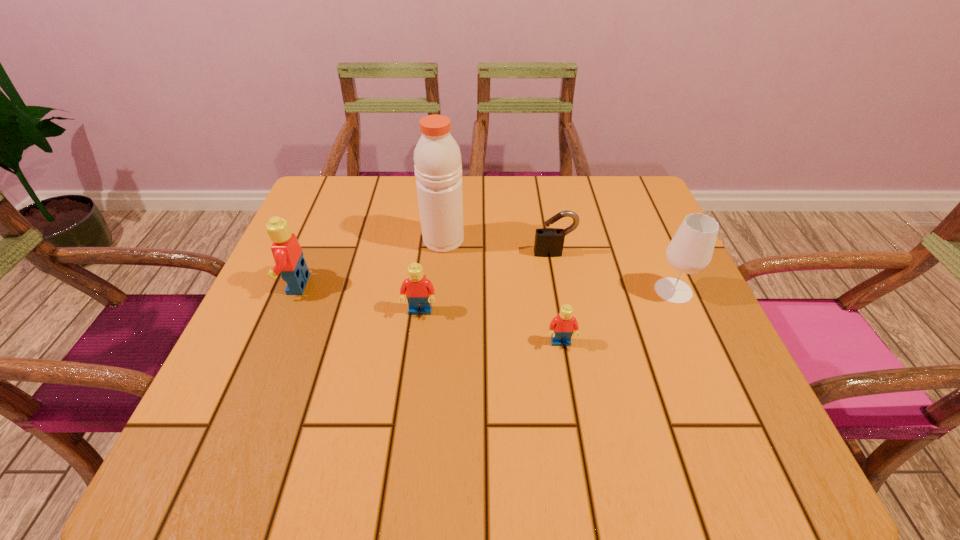
Identify the location of vacant space that satisfies the following two spatial constraints: 1. on the face of the rightmost object; 2. on the right side of the leftmost Lego. Image resolution: width=960 pixels, height=540 pixels. (294, 291).